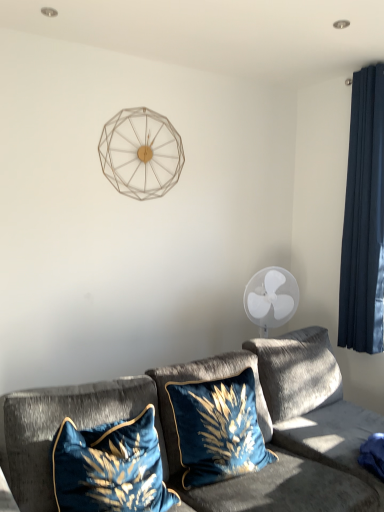
Question: Can you confirm if metallic wireframe clock at upper center is wider than velvet gray couch at lower center?

Choices:
 (A) no
 (B) yes

Answer: (A)

Question: Considering the relative sizes of metallic wireframe clock at upper center and velvet gray couch at lower center in the image provided, is metallic wireframe clock at upper center thinner than velvet gray couch at lower center?

Choices:
 (A) yes
 (B) no

Answer: (A)

Question: Does metallic wireframe clock at upper center have a greater height compared to velvet gray couch at lower center?

Choices:
 (A) no
 (B) yes

Answer: (A)

Question: Is metallic wireframe clock at upper center turned away from velvet gray couch at lower center?

Choices:
 (A) yes
 (B) no

Answer: (B)

Question: Does metallic wireframe clock at upper center have a smaller size compared to velvet gray couch at lower center?

Choices:
 (A) yes
 (B) no

Answer: (A)

Question: Relative to velvet gray couch at lower center, is velvet blue pillow at lower left, positioned as the 1th pillow in left-to-right order, in front or behind?

Choices:
 (A) behind
 (B) front

Answer: (A)

Question: Visually, is velvet blue pillow at lower left, acting as the 2th pillow starting from the right, positioned to the left or to the right of velvet gray couch at lower center?

Choices:
 (A) right
 (B) left

Answer: (B)

Question: Considering the positions of point (145, 419) and point (14, 426), is point (145, 419) closer or farther from the camera than point (14, 426)?

Choices:
 (A) closer
 (B) farther

Answer: (B)

Question: Considering the positions of velvet blue pillow at lower left, acting as the 2th pillow starting from the right, and velvet gray couch at lower center in the image, is velvet blue pillow at lower left, acting as the 2th pillow starting from the right, bigger or smaller than velvet gray couch at lower center?

Choices:
 (A) big
 (B) small

Answer: (B)

Question: Is velvet blue pillow at center, which is the 1th pillow from right to left, inside or outside of dark blue velvet curtain at right?

Choices:
 (A) outside
 (B) inside

Answer: (A)

Question: Visually, is velvet blue pillow at center, which ranks as the 2th pillow in left-to-right order, positioned to the left or to the right of dark blue velvet curtain at right?

Choices:
 (A) right
 (B) left

Answer: (B)

Question: From a real-world perspective, is velvet blue pillow at center, which is the 1th pillow from right to left, above or below dark blue velvet curtain at right?

Choices:
 (A) below
 (B) above

Answer: (A)

Question: From the image's perspective, is velvet blue pillow at center, which ranks as the 2th pillow in left-to-right order, positioned above or below dark blue velvet curtain at right?

Choices:
 (A) above
 (B) below

Answer: (B)

Question: Is point (104, 159) positioned closer to the camera than point (183, 480)?

Choices:
 (A) closer
 (B) farther

Answer: (B)

Question: From a real-world perspective, is metallic wireframe clock at upper center physically located above or below velvet blue pillow at center, which is the 1th pillow from right to left?

Choices:
 (A) above
 (B) below

Answer: (A)